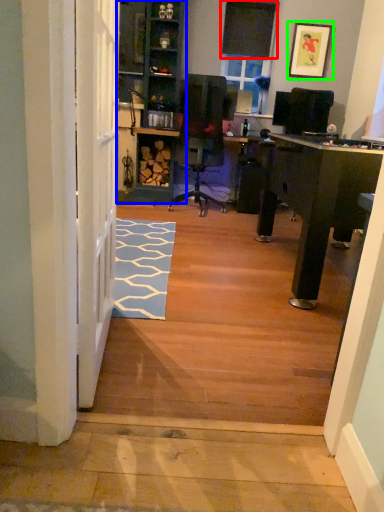
Question: Estimate the real-world distances between objects in this image. Which object is farther from window screen (highlighted by a red box), bookshelf (highlighted by a blue box) or picture frame (highlighted by a green box)?

Choices:
 (A) bookshelf
 (B) picture frame

Answer: (A)